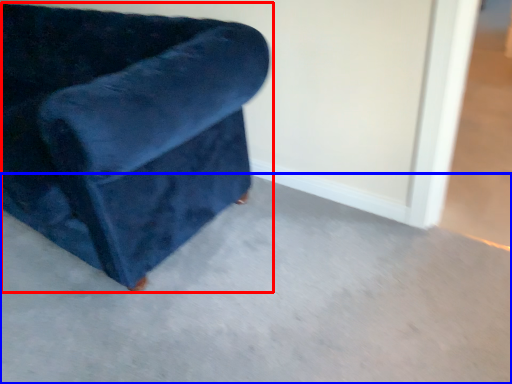
Question: Which point is closer to the camera, chair (highlighted by a red box) or concrete (highlighted by a blue box)?

Choices:
 (A) chair
 (B) concrete

Answer: (B)